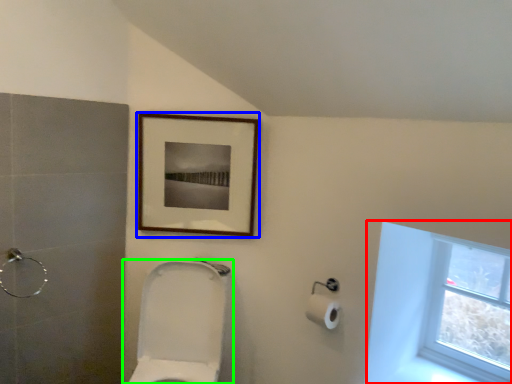
Question: Estimate the real-world distances between objects in this image. Which object is closer to window (highlighted by a red box), picture frame (highlighted by a blue box) or toilet (highlighted by a green box)?

Choices:
 (A) picture frame
 (B) toilet

Answer: (A)